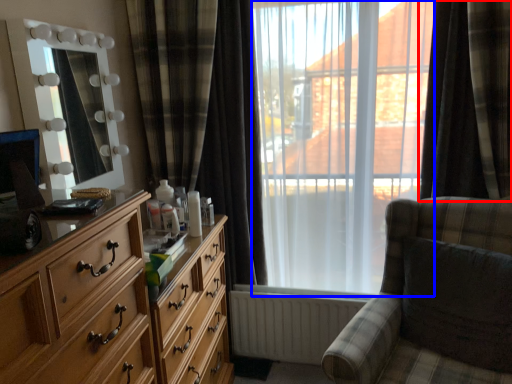
Question: Which object appears closest to the camera in this image, curtain (highlighted by a red box) or bay window (highlighted by a blue box)?

Choices:
 (A) curtain
 (B) bay window

Answer: (A)